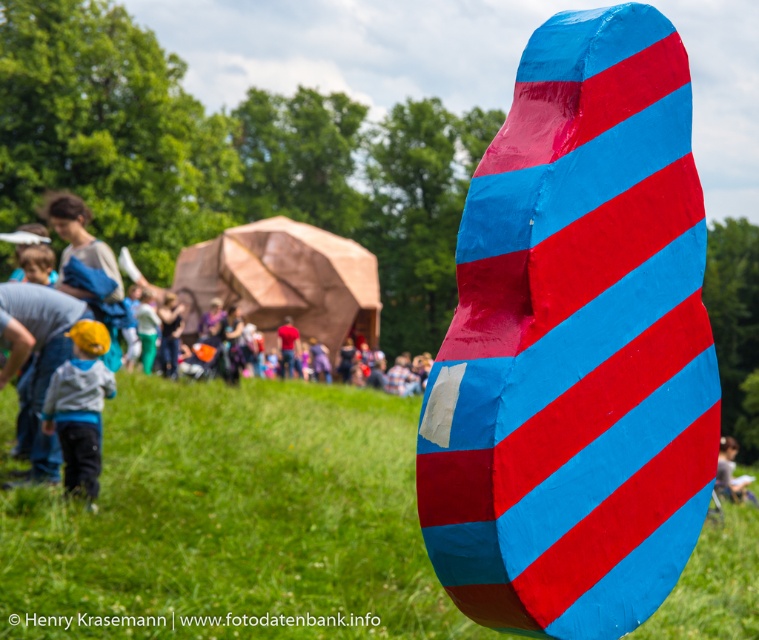
Question: Considering the real-world distances, which object is closest to the matte yellow cap at lower left?

Choices:
 (A) shiny plastic rock at center
 (B) wooden dome at center
 (C) matte blue paper at center

Answer: (C)

Question: Which point appears closest to the camera in this image?

Choices:
 (A) (742, 484)
 (B) (257, 355)

Answer: (A)

Question: Considering the relative positions of matte yellow cap at lower left and wooden dome at center in the image provided, where is matte yellow cap at lower left located with respect to wooden dome at center?

Choices:
 (A) below
 (B) above

Answer: (A)

Question: Does shiny plastic rock at center appear on the left side of wooden dome at center?

Choices:
 (A) yes
 (B) no

Answer: (B)

Question: Does green grass at center come behind matte yellow cap at lower left?

Choices:
 (A) no
 (B) yes

Answer: (A)

Question: Based on their relative distances, which object is nearer to the shiny plastic rock at center?

Choices:
 (A) matte blue paper at center
 (B) wooden dome at center

Answer: (A)